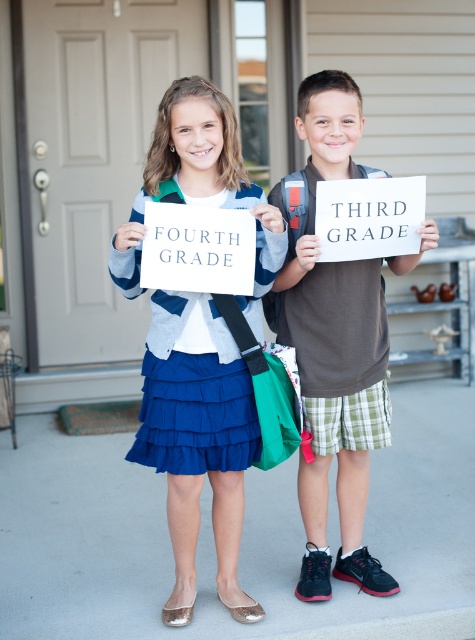
Is point (233, 372) closer to camera compared to point (297, 476)?

Yes, point (233, 372) is in front of point (297, 476).

Between point (197, 378) and point (323, 307), which one is positioned in front?

Point (197, 378) is in front.

Does point (255, 609) come farther from viewer compared to point (340, 404)?

No, it is not.

Identify the location of blue fabric skirt at center. (198, 440).